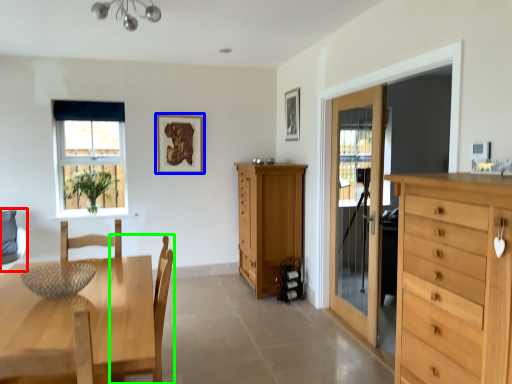
Question: Estimate the real-world distances between objects in this image. Which object is closer to swivel chair (highlighted by a red box), picture frame (highlighted by a blue box) or chair (highlighted by a green box)?

Choices:
 (A) picture frame
 (B) chair

Answer: (A)